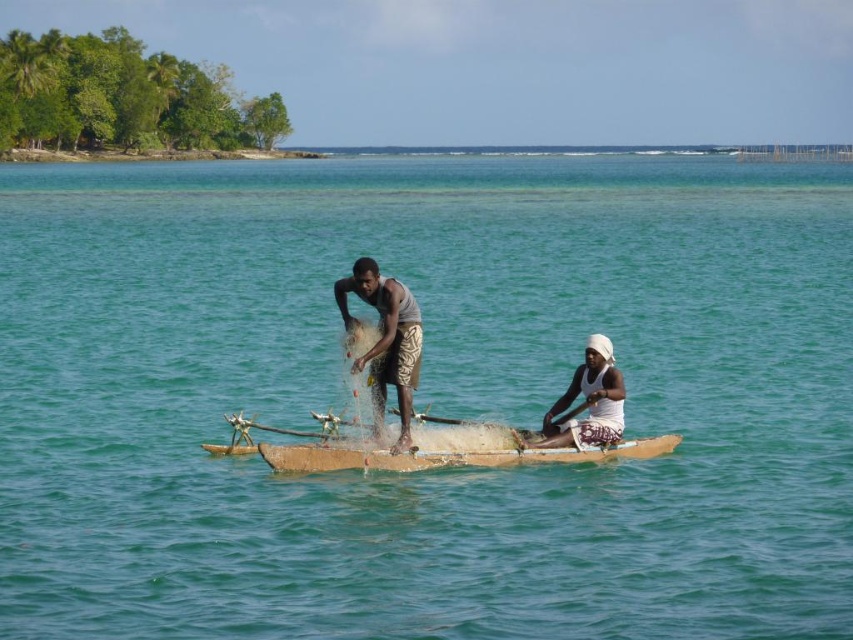
Can you confirm if gray fabric net at center is positioned to the right of brown wooden canoe at center?

Incorrect, gray fabric net at center is not on the right side of brown wooden canoe at center.

Between point (403, 365) and point (318, 465), which one is positioned in front?

Point (318, 465) is more forward.

This screenshot has width=853, height=640. Find the location of `gray fabric net at center`. gray fabric net at center is located at coordinates (386, 340).

Is gray fabric net at center behind white woven hat at center?

Yes.

Is gray fabric net at center thinner than white woven hat at center?

Correct, gray fabric net at center's width is less than white woven hat at center's.

This screenshot has height=640, width=853. In order to click on gray fabric net at center in this screenshot , I will do `click(386, 340)`.

Locate an element on the screen. gray fabric net at center is located at coordinates (386, 340).

Does brown wooden canoe at center have a smaller size compared to white woven hat at center?

Indeed, brown wooden canoe at center has a smaller size compared to white woven hat at center.

Locate an element on the screen. This screenshot has height=640, width=853. brown wooden canoe at center is located at coordinates (450, 456).